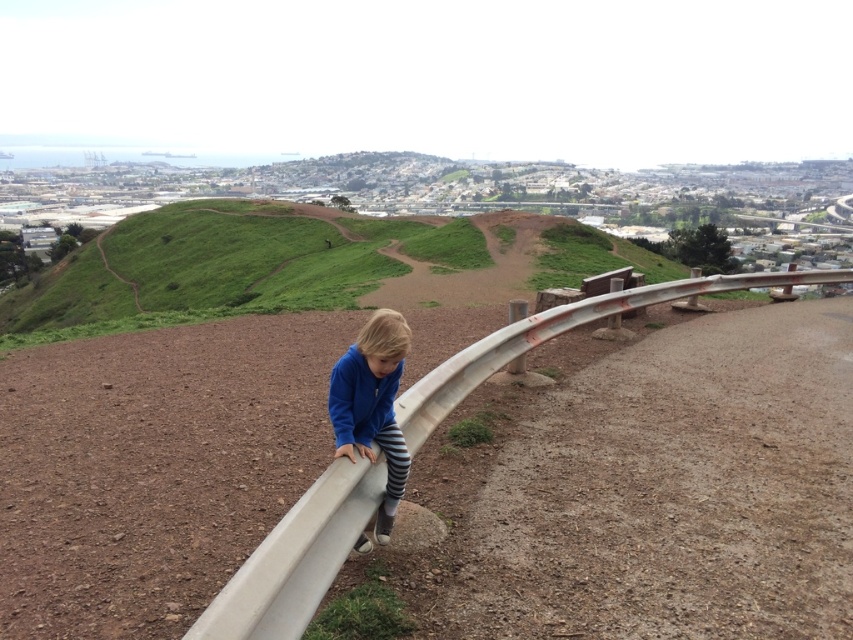
You are a parent trying to ensure the safety of your child. The white matte rail at center is the only barrier between your child and the edge of a cliff. If your child wearing the blue fleece jacket at center is currently 12.45 feet away from the rail, is there enough space to safely stop them from reaching the rail?

The distance between the white matte rail at center and the blue fleece jacket at center is 12.45 feet. Since the child is 12.45 feet away from the rail, there is sufficient space to safely stop them from reaching the rail.

You are a parent trying to ensure your child stays safe near the guardrail. The white matte rail at center and the blue fleece jacket at center are in your line of sight. Which object is closer to you?

The white matte rail at center is positioned over the blue fleece jacket at center, meaning it is closer to you.